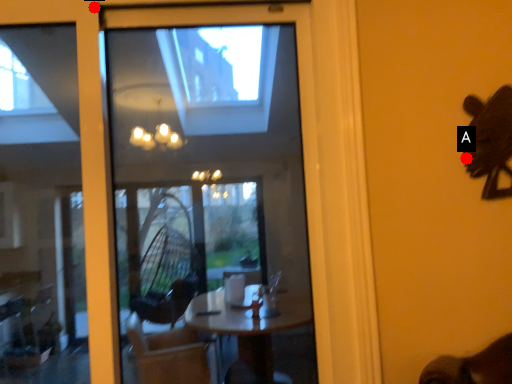
Question: Two points are circled on the image, labeled by A and B beside each circle. Which point appears farthest from the camera in this image?

Choices:
 (A) A is further
 (B) B is further

Answer: (A)